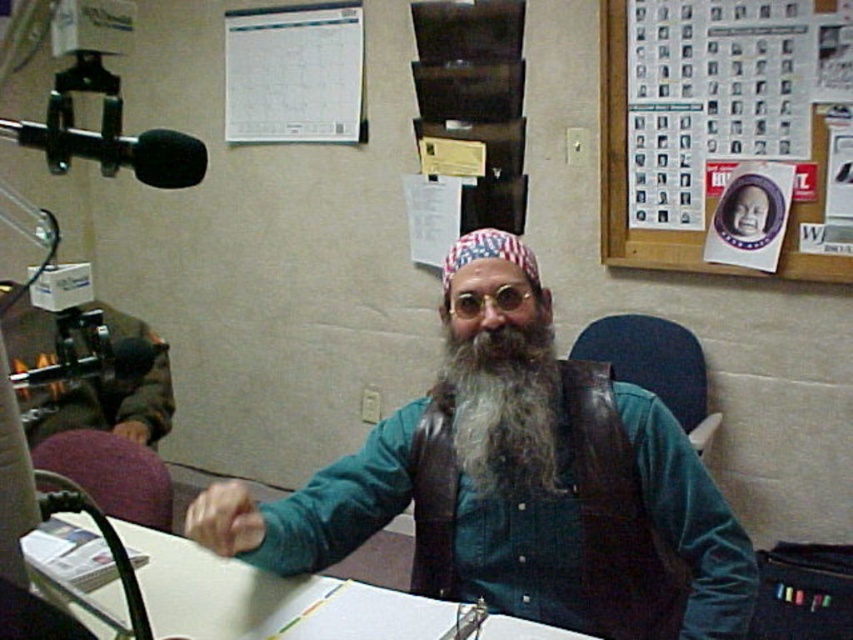
You are standing in front of the desk in the scene. There is a point marked at coordinates [514,477]. What object is located at that point?

The point at coordinates [514,477] corresponds to the green denim shirt at center.